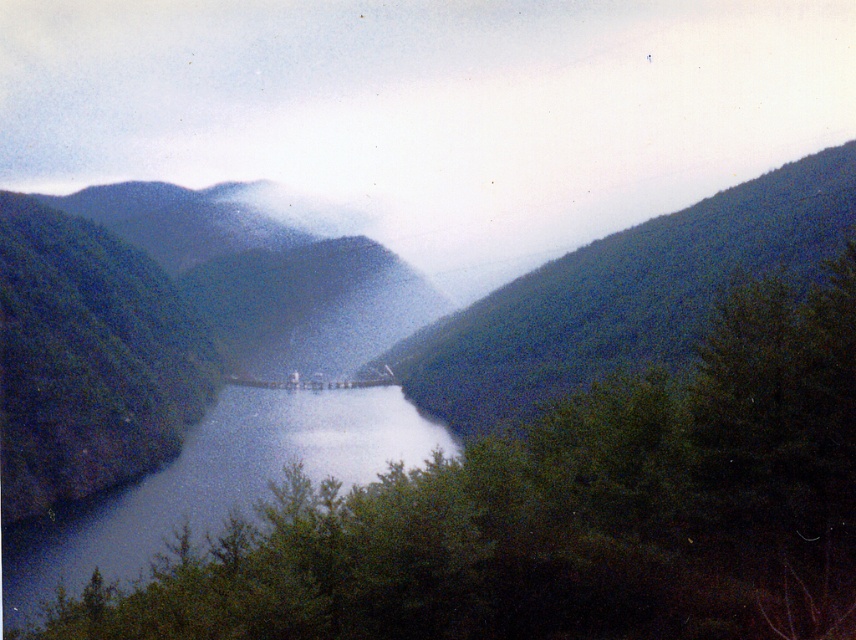
You are planning to build a small cabin in the serene landscape. The cabin requires a foundation that must be higher than the blue glassy lake at center to avoid flooding. Given that the green textured hillside at center is taller than the lake, could the hillside provide a suitable elevation for the cabin?

Yes, the green textured hillside at center has a greater height compared to the blue glassy lake at center, making it a suitable elevated location to build the cabin and avoid flooding.

In the scene shown: You are a hiker standing at the edge of the blue glassy lake at center. You want to reach the green leafy tree at center. Which direction should you walk to get there?

The green leafy tree at center is to the right of the blue glassy lake at center, so you should walk to the right to reach it.

Consider the image. You are an environmental scientist assessing the landscape. You need to determine which object between the green leafy tree at center and the blue glassy lake at center is taller. Based on the scene, which one is taller?

The blue glassy lake at center is taller than the green leafy tree at center according to the description provided.